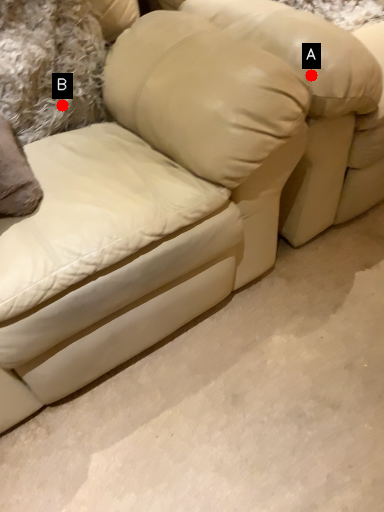
Question: Two points are circled on the image, labeled by A and B beside each circle. Which point is closer to the camera?

Choices:
 (A) A is closer
 (B) B is closer

Answer: (A)